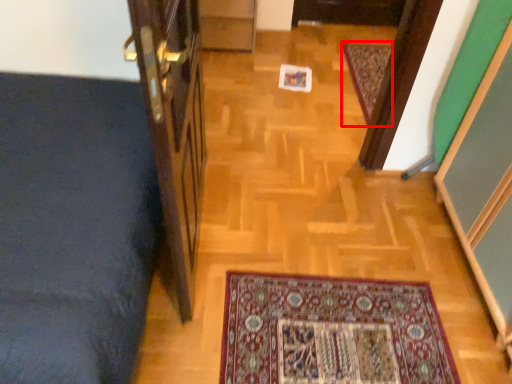
Question: Considering the relative positions of mat (annotated by the red box) and door in the image provided, where is mat (annotated by the red box) located with respect to the staircase?

Choices:
 (A) left
 (B) right

Answer: (B)